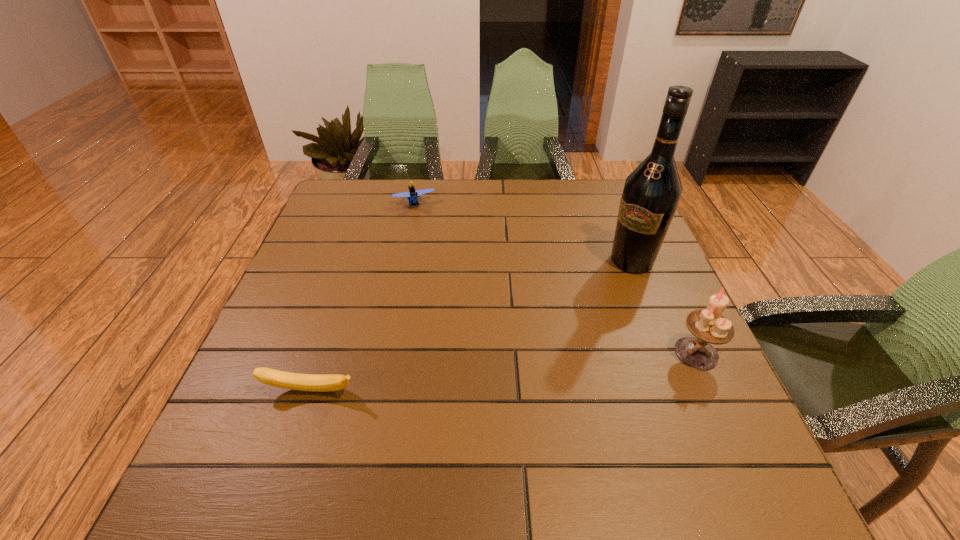
In order to click on free space between the second tallest object and the tallest object in this screenshot , I will do `click(664, 307)`.

This screenshot has height=540, width=960. Identify the location of vacant area between the third shortest object and the banana. (503, 372).

Locate an element on the screen. unoccupied position between the candle holder and the tallest object is located at coordinates (664, 307).

Locate an element on the screen. free space between the wine bottle and the nearest object is located at coordinates (471, 326).

In order to click on free area in between the candle holder and the tallest object in this screenshot , I will do `click(664, 307)`.

Where is `free space that is in between the nearest object and the second farthest object`? The image size is (960, 540). free space that is in between the nearest object and the second farthest object is located at coordinates (471, 326).

Locate an element on the screen. empty space that is in between the farthest object and the nearest object is located at coordinates (362, 297).

At what (x,y) coordinates should I click in order to perform the action: click on free space that is in between the Lego and the second tallest object. Please return your answer as a coordinate pair (x, y). This screenshot has height=540, width=960. Looking at the image, I should click on (556, 278).

Identify the location of object that stands as the third closest to the second tallest object. (412, 196).

Where is `object that stands as the second closest to the third farthest object`? object that stands as the second closest to the third farthest object is located at coordinates (303, 382).